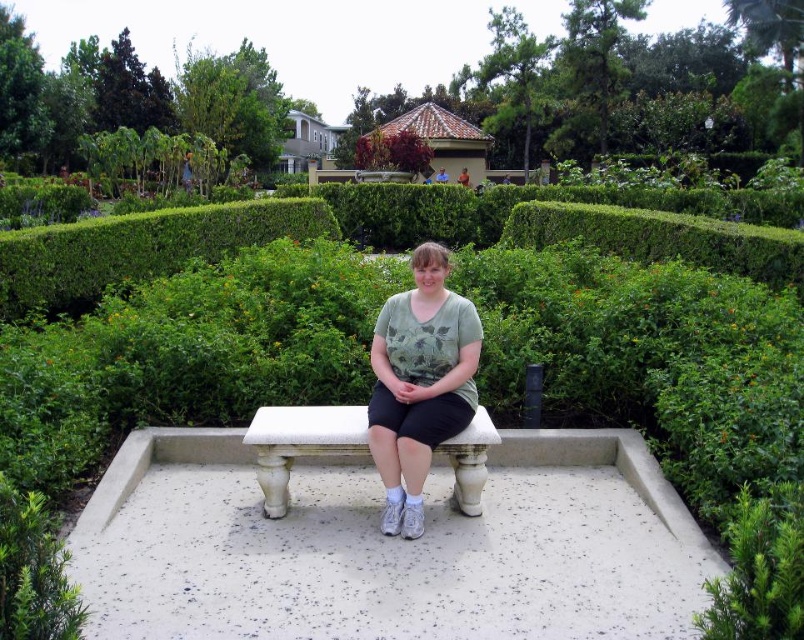
You are a gardener who wants to place a new potted plant between the white speckled concrete bench at center and the white stone bench at center. Which bench should you place the plant closer to if you want it to be taller than the bench?

You should place the plant closer to the white stone bench at center because the white speckled concrete bench at center is shorter than the white stone bench at center, so the plant will be taller than the concrete bench.

You are standing at the entrance of the garden and want to find the white speckled concrete bench at center. According to the garden layout, where should you look to locate it?

The white speckled concrete bench at center is located at point (x=388, y=547), so you should look towards the center of the garden to find it.

You are standing at the entrance of the garden and see the point marked at coordinates (x=388, y=547). What object does this point indicate?

The point at coordinates (x=388, y=547) marks the white speckled concrete bench at center.